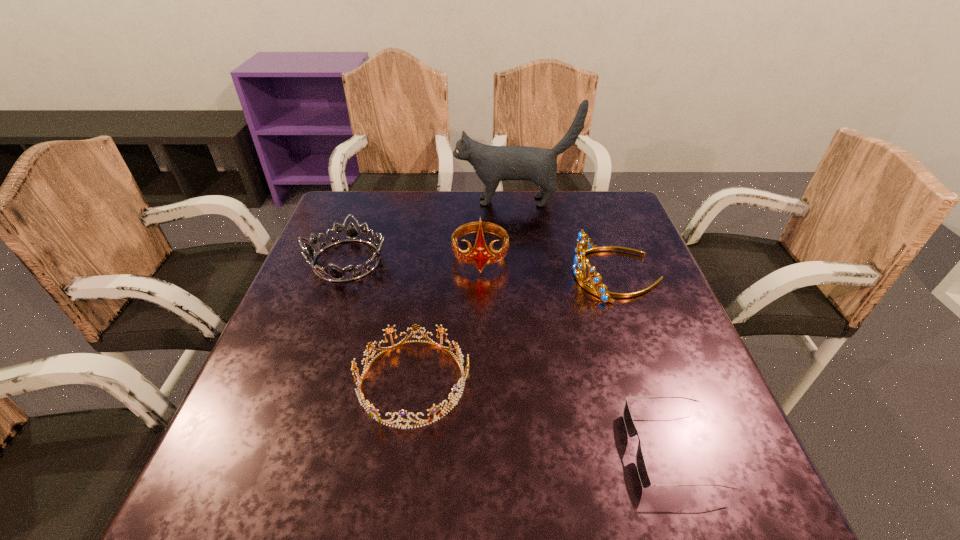
Find the location of a particular element. object positioned at the left edge is located at coordinates 352,234.

I want to click on cat that is at the right edge, so click(x=492, y=164).

The height and width of the screenshot is (540, 960). I want to click on tiara that is positioned at the right edge, so click(x=583, y=239).

Image resolution: width=960 pixels, height=540 pixels. I want to click on sunglasses that is positioned at the right edge, so click(x=631, y=430).

The width and height of the screenshot is (960, 540). What are the coordinates of `object located at the far right corner` in the screenshot? It's located at (492, 164).

This screenshot has height=540, width=960. I want to click on object at the near right corner, so click(x=631, y=430).

I want to click on blank space at the far edge, so click(x=453, y=207).

The height and width of the screenshot is (540, 960). Find the location of `vacant region at the near edge`. vacant region at the near edge is located at coordinates (453, 522).

In the image, there is a desktop. What are the coordinates of `blank space at the left edge` in the screenshot? It's located at (303, 357).

Find the location of `free space at the right edge`. free space at the right edge is located at coordinates click(622, 257).